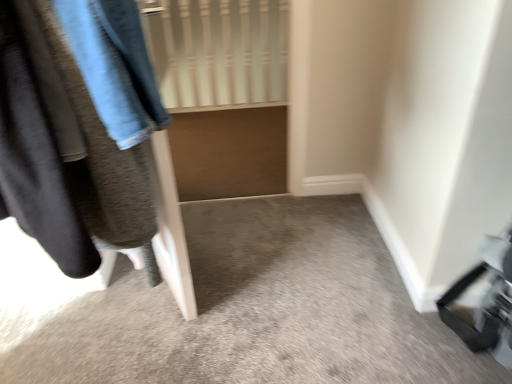
The width and height of the screenshot is (512, 384). I want to click on denim fabric at left, so click(85, 161).

The height and width of the screenshot is (384, 512). Describe the element at coordinates (85, 161) in the screenshot. I see `denim fabric at left` at that location.

The width and height of the screenshot is (512, 384). What are the coordinates of `denim fabric at left` in the screenshot? It's located at (85, 161).